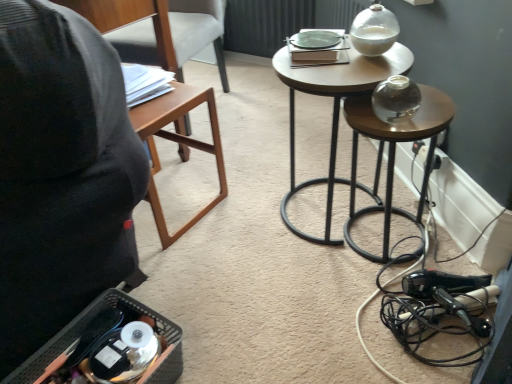
You are a GUI agent. You are given a task and a screenshot of the screen. Output one action in this format:
    pyautogui.click(x=<x>, y=<y>)
    Task: Click on the transparent glass vase at center right, the first stool in the right-to-left sequence
    This screenshot has height=384, width=512.
    Given the screenshot: What is the action you would take?
    pyautogui.click(x=394, y=154)

What do you see at coordinates (420, 149) in the screenshot?
I see `white plastic electric outlet at lower right` at bounding box center [420, 149].

What do you see at coordinates (333, 110) in the screenshot?
I see `wooden glossy stool at upper center, which ranks as the first stool in left-to-right order` at bounding box center [333, 110].

Locate an element on the screen. The height and width of the screenshot is (384, 512). brown wood table at left is located at coordinates (178, 144).

Find the location of a particular element. transparent glass vase at center right, positioned as the second stool in left-to-right order is located at coordinates (394, 154).

From the image's perspective, is wooden glossy stool at upper center, positioned as the 2th stool in right-to-left order, over wooden chair at left?

No, from the image's perspective, wooden glossy stool at upper center, positioned as the 2th stool in right-to-left order, is not above wooden chair at left.

What's the angular difference between wooden glossy stool at upper center, which ranks as the first stool in left-to-right order, and wooden chair at left's facing directions?

12.2 degrees separate the facing orientations of wooden glossy stool at upper center, which ranks as the first stool in left-to-right order, and wooden chair at left.

From a real-world perspective, is wooden glossy stool at upper center, which ranks as the first stool in left-to-right order, positioned above or below wooden chair at left?

Clearly, from a real-world perspective, wooden glossy stool at upper center, which ranks as the first stool in left-to-right order, is below wooden chair at left.

Between point (199, 18) and point (224, 171), which one is positioned behind?

Positioned behind is point (199, 18).

Is brown wood table at left at the back of wooden chair at left?

No, brown wood table at left is not at the back of wooden chair at left.

Who is taller, brown wood table at left or white plastic electric outlet at lower right?

Standing taller between the two is brown wood table at left.

Is brown wood table at left surrounding white plastic electric outlet at lower right?

Actually, white plastic electric outlet at lower right is outside brown wood table at left.

Is brown wood table at left at the left side of white plastic electric outlet at lower right?

Indeed, brown wood table at left is positioned on the left side of white plastic electric outlet at lower right.

Does brown wood table at left have a lesser width compared to white plastic electric outlet at lower right?

In fact, brown wood table at left might be wider than white plastic electric outlet at lower right.

Considering the relative sizes of wooden glossy stool at upper center, positioned as the 2th stool in right-to-left order, and transparent glass vase at center right, the first stool in the right-to-left sequence, in the image provided, is wooden glossy stool at upper center, positioned as the 2th stool in right-to-left order, shorter than transparent glass vase at center right, the first stool in the right-to-left sequence,?

No.

Is wooden glossy stool at upper center, which ranks as the first stool in left-to-right order, to the left or to the right of transparent glass vase at center right, positioned as the second stool in left-to-right order, in the image?

From the image, it's evident that wooden glossy stool at upper center, which ranks as the first stool in left-to-right order, is to the left of transparent glass vase at center right, positioned as the second stool in left-to-right order.

Which point is more distant from viewer, (311, 82) or (415, 136)?

Point (311, 82)

From a real-world perspective, is wooden glossy stool at upper center, positioned as the 2th stool in right-to-left order, physically located above or below transparent glass vase at center right, positioned as the second stool in left-to-right order?

From a real-world perspective, wooden glossy stool at upper center, positioned as the 2th stool in right-to-left order, is physically above transparent glass vase at center right, positioned as the second stool in left-to-right order.

Consider the image. Is the depth of wooden glossy stool at upper center, positioned as the 2th stool in right-to-left order, greater than that of brown wood table at left?

No, wooden glossy stool at upper center, positioned as the 2th stool in right-to-left order, is closer to the viewer.

Is wooden glossy stool at upper center, positioned as the 2th stool in right-to-left order, next to brown wood table at left and touching it?

No, wooden glossy stool at upper center, positioned as the 2th stool in right-to-left order, is not next to brown wood table at left.

Is wooden glossy stool at upper center, which ranks as the first stool in left-to-right order, inside or outside of brown wood table at left?

wooden glossy stool at upper center, which ranks as the first stool in left-to-right order, is not inside brown wood table at left, it's outside.

Is wooden glossy stool at upper center, which ranks as the first stool in left-to-right order, facing away from brown wood table at left?

wooden glossy stool at upper center, which ranks as the first stool in left-to-right order, does not have its back to brown wood table at left.

Which is more to the right, wooden glossy stool at upper center, which ranks as the first stool in left-to-right order, or white plastic electric outlet at lower right?

white plastic electric outlet at lower right is more to the right.

Are wooden glossy stool at upper center, which ranks as the first stool in left-to-right order, and white plastic electric outlet at lower right far apart?

No, wooden glossy stool at upper center, which ranks as the first stool in left-to-right order, is not far away from white plastic electric outlet at lower right.

Is wooden glossy stool at upper center, which ranks as the first stool in left-to-right order, not within white plastic electric outlet at lower right?

Indeed, wooden glossy stool at upper center, which ranks as the first stool in left-to-right order, is completely outside white plastic electric outlet at lower right.

Can you confirm if wooden glossy stool at upper center, which ranks as the first stool in left-to-right order, is wider than white plastic electric outlet at lower right?

Indeed, wooden glossy stool at upper center, which ranks as the first stool in left-to-right order, has a greater width compared to white plastic electric outlet at lower right.

From a real-world perspective, who is located higher, white plastic electric outlet at lower right or brown wood table at left?

From a 3D spatial view, brown wood table at left is above.

Between white plastic electric outlet at lower right and brown wood table at left, which one has more height?

brown wood table at left.

Is white plastic electric outlet at lower right not near brown wood table at left?

No, there isn't a large distance between white plastic electric outlet at lower right and brown wood table at left.

This screenshot has width=512, height=384. I want to click on table that appears on the left of white plastic electric outlet at lower right, so click(178, 144).

Identify the location of the 1st stool below the wooden chair at left (from a real-world perspective). pyautogui.click(x=333, y=110).

Find the location of a particular element. table in front of the wooden chair at left is located at coordinates (178, 144).

Considering their positions, is brown wood table at left positioned further to wooden chair at left than transparent glass vase at center right, the first stool in the right-to-left sequence?

Among the two, transparent glass vase at center right, the first stool in the right-to-left sequence, is located further to wooden chair at left.

From the image, which object appears to be nearer to brown wood table at left, wooden chair at left or wooden glossy stool at upper center, which ranks as the first stool in left-to-right order?

wooden glossy stool at upper center, which ranks as the first stool in left-to-right order, is closer to brown wood table at left.

Considering their positions, is transparent glass vase at center right, positioned as the second stool in left-to-right order, positioned further to brown wood table at left than white plastic electric outlet at lower right?

white plastic electric outlet at lower right lies further to brown wood table at left than the other object.

From the image, which object appears to be nearer to transparent glass vase at center right, positioned as the second stool in left-to-right order, wooden chair at left or brown wood table at left?

Based on the image, brown wood table at left appears to be nearer to transparent glass vase at center right, positioned as the second stool in left-to-right order.

Which object lies further to the anchor point brown wood table at left, wooden glossy stool at upper center, which ranks as the first stool in left-to-right order, or wooden chair at left?

wooden chair at left is further to brown wood table at left.

Which object lies nearer to the anchor point white plastic electric outlet at lower right, wooden chair at left or brown wood table at left?

brown wood table at left.

Looking at the image, which one is located further to brown wood table at left, wooden glossy stool at upper center, which ranks as the first stool in left-to-right order, or white plastic electric outlet at lower right?

Based on the image, white plastic electric outlet at lower right appears to be further to brown wood table at left.

Based on their spatial positions, is brown wood table at left or wooden chair at left further from transparent glass vase at center right, the first stool in the right-to-left sequence?

The object further to transparent glass vase at center right, the first stool in the right-to-left sequence, is wooden chair at left.

I want to click on table situated between wooden chair at left and wooden glossy stool at upper center, positioned as the 2th stool in right-to-left order, from left to right, so click(178, 144).

Find the location of a particular element. The image size is (512, 384). stool between transparent glass vase at center right, positioned as the second stool in left-to-right order, and white plastic electric outlet at lower right in the front-back direction is located at coordinates (333, 110).

I want to click on stool between wooden chair at left and transparent glass vase at center right, the first stool in the right-to-left sequence, in the horizontal direction, so click(x=333, y=110).

You are a GUI agent. You are given a task and a screenshot of the screen. Output one action in this format:
    pyautogui.click(x=<x>, y=<y>)
    Task: Click on the stool situated between brown wood table at left and transparent glass vase at center right, positioned as the second stool in left-to-right order, from left to right
    This screenshot has width=512, height=384.
    Given the screenshot: What is the action you would take?
    pyautogui.click(x=333, y=110)